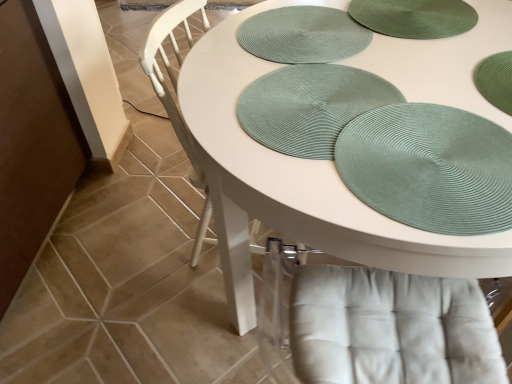
Question: Is green textured placemat at upper center, placed as the 1th platter when sorted from back to front, at the left side of green textured placemat at upper right?

Choices:
 (A) yes
 (B) no

Answer: (A)

Question: Does green textured placemat at upper center, which ranks as the 2th platter in front-to-back order, have a greater height compared to green textured placemat at upper right?

Choices:
 (A) no
 (B) yes

Answer: (A)

Question: Is green textured placemat at upper right at the back of green textured placemat at upper center, placed as the 1th platter when sorted from back to front?

Choices:
 (A) no
 (B) yes

Answer: (B)

Question: From a real-world perspective, is green textured placemat at upper center, which ranks as the 2th platter in front-to-back order, below green textured placemat at upper right?

Choices:
 (A) yes
 (B) no

Answer: (A)

Question: Does green textured placemat at upper center, placed as the 1th platter when sorted from back to front, have a lesser width compared to green textured placemat at upper right?

Choices:
 (A) yes
 (B) no

Answer: (B)

Question: Can we say green textured placemat at upper center, placed as the 1th platter when sorted from back to front, lies outside green textured placemat at upper right?

Choices:
 (A) no
 (B) yes

Answer: (B)

Question: From a real-world perspective, is white textured chair at center positioned under green textured placemat at upper right based on gravity?

Choices:
 (A) yes
 (B) no

Answer: (A)

Question: From the image's perspective, is white textured chair at center under green textured placemat at upper right?

Choices:
 (A) no
 (B) yes

Answer: (A)

Question: Is white textured chair at center smaller than green textured placemat at upper right?

Choices:
 (A) no
 (B) yes

Answer: (A)

Question: Is white textured chair at center completely or partially outside of green textured placemat at upper right?

Choices:
 (A) yes
 (B) no

Answer: (A)

Question: Considering the relative positions of white textured chair at center and green textured placemat at upper right in the image provided, is white textured chair at center to the right of green textured placemat at upper right from the viewer's perspective?

Choices:
 (A) yes
 (B) no

Answer: (B)

Question: Does white textured chair at center come in front of green textured placemat at upper right?

Choices:
 (A) no
 (B) yes

Answer: (A)

Question: Is green textured placemat at upper right far from green woven placemat at center, placed as the first platter when sorted from front to back?

Choices:
 (A) yes
 (B) no

Answer: (B)